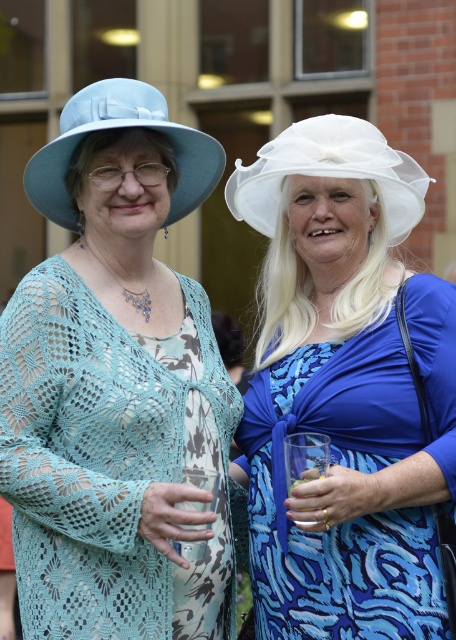
Question: Does matte blue hat at left appear on the right side of matte blue fabric hat at upper left?

Choices:
 (A) no
 (B) yes

Answer: (B)

Question: Which object appears closest to the camera in this image?

Choices:
 (A) matte blue fabric hat at upper left
 (B) matte blue hat at left
 (C) white sheer fabric hat at upper center
 (D) white sheer hat at upper center

Answer: (B)

Question: Which of the following is the farthest from the observer?

Choices:
 (A) (311, 147)
 (B) (171, 349)

Answer: (A)

Question: Can you confirm if white sheer hat at upper center is thinner than matte blue fabric hat at upper left?

Choices:
 (A) no
 (B) yes

Answer: (B)

Question: Does white sheer hat at upper center come in front of matte blue fabric hat at upper left?

Choices:
 (A) no
 (B) yes

Answer: (A)

Question: Among these objects, which one is nearest to the camera?

Choices:
 (A) white sheer hat at upper center
 (B) matte blue fabric hat at upper left

Answer: (B)